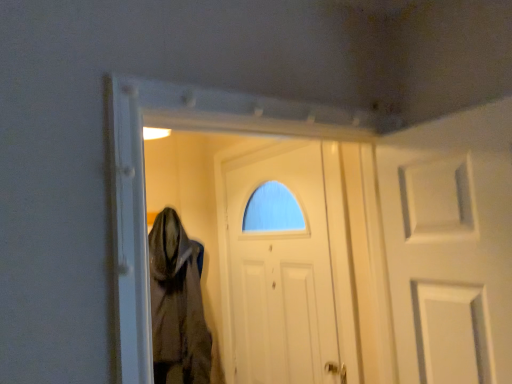
Question: From a real-world perspective, is white matte door at center on brown textured cloth at center?

Choices:
 (A) yes
 (B) no

Answer: (A)

Question: Is white matte door at center closer to the viewer compared to brown textured cloth at center?

Choices:
 (A) no
 (B) yes

Answer: (B)

Question: Is white matte door at center wider than brown textured cloth at center?

Choices:
 (A) yes
 (B) no

Answer: (B)

Question: Is white matte door at center oriented away from brown textured cloth at center?

Choices:
 (A) no
 (B) yes

Answer: (A)

Question: From a real-world perspective, is white matte door at center physically below brown textured cloth at center?

Choices:
 (A) no
 (B) yes

Answer: (A)

Question: Can you confirm if white matte door at center is shorter than brown textured cloth at center?

Choices:
 (A) yes
 (B) no

Answer: (B)

Question: From a real-world perspective, does brown textured cloth at center stand above white matte door at center?

Choices:
 (A) no
 (B) yes

Answer: (A)

Question: Does brown textured cloth at center have a larger size compared to white matte door at center?

Choices:
 (A) yes
 (B) no

Answer: (B)

Question: From the image's perspective, is brown textured cloth at center below white matte door at center?

Choices:
 (A) yes
 (B) no

Answer: (A)

Question: Is brown textured cloth at center positioned beyond the bounds of white matte door at center?

Choices:
 (A) yes
 (B) no

Answer: (A)

Question: Is brown textured cloth at center behind white matte door at center?

Choices:
 (A) yes
 (B) no

Answer: (A)

Question: Can you confirm if brown textured cloth at center is wider than white matte door at center?

Choices:
 (A) no
 (B) yes

Answer: (B)

Question: Considering the relative positions of brown textured cloth at center and white matte door at center in the image provided, is brown textured cloth at center to the left or to the right of white matte door at center?

Choices:
 (A) right
 (B) left

Answer: (B)